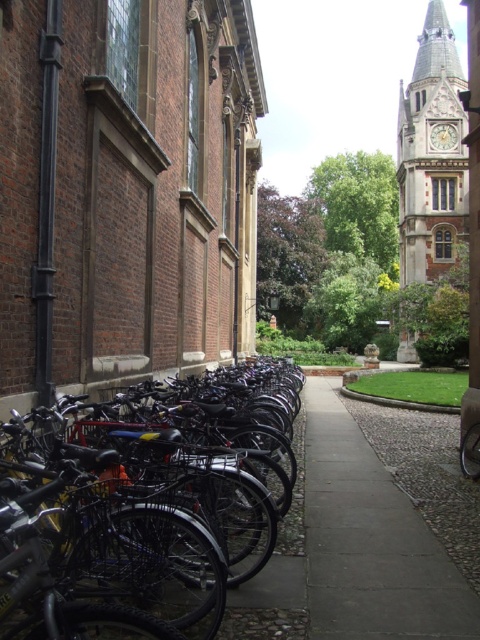
Question: Among these objects, which one is nearest to the camera?

Choices:
 (A) gray concrete pavement at center
 (B) brown stone clock tower at upper right
 (C) black matte bicycle at left

Answer: (C)

Question: Can you confirm if black matte bicycle at left is positioned below brown stone clock tower at upper right?

Choices:
 (A) no
 (B) yes

Answer: (B)

Question: Can you confirm if gray concrete pavement at center is positioned to the left of brown stone clock tower at upper right?

Choices:
 (A) no
 (B) yes

Answer: (B)

Question: Which point is farther from the camera taking this photo?

Choices:
 (A) (459, 138)
 (B) (369, 493)
 (C) (251, 387)

Answer: (A)

Question: Which point is closer to the camera taking this photo?

Choices:
 (A) (404, 248)
 (B) (395, 625)

Answer: (B)

Question: Does gray concrete pavement at center appear on the left side of brown stone clock tower at upper right?

Choices:
 (A) yes
 (B) no

Answer: (A)